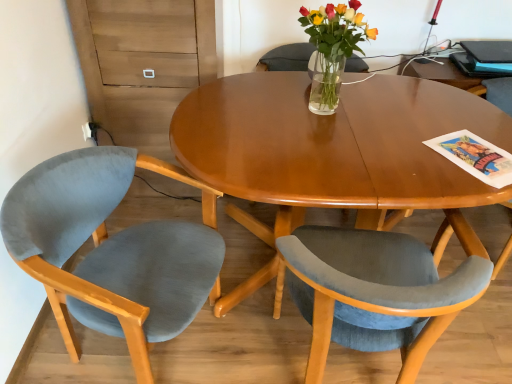
Question: Is clear glass vase at center facing towards velvet blue chair at right, placed as the 3th chair when sorted from left to right?

Choices:
 (A) no
 (B) yes

Answer: (A)

Question: Is clear glass vase at center to the right of velvet blue chair at right, which ranks as the first chair in right-to-left order, from the viewer's perspective?

Choices:
 (A) yes
 (B) no

Answer: (B)

Question: From a real-world perspective, is clear glass vase at center on top of velvet blue chair at right, which ranks as the first chair in right-to-left order?

Choices:
 (A) no
 (B) yes

Answer: (B)

Question: Would you say velvet blue chair at right, placed as the 3th chair when sorted from left to right, is part of clear glass vase at center's contents?

Choices:
 (A) yes
 (B) no

Answer: (B)

Question: Can you see clear glass vase at center touching velvet blue chair at right, placed as the 3th chair when sorted from left to right?

Choices:
 (A) no
 (B) yes

Answer: (A)

Question: In the image, is clear glass vase at center positioned in front of or behind blue glossy magazine at upper right?

Choices:
 (A) behind
 (B) front

Answer: (B)

Question: From a real-world perspective, is clear glass vase at center physically located above or below blue glossy magazine at upper right?

Choices:
 (A) below
 (B) above

Answer: (B)

Question: Is clear glass vase at center inside or outside of blue glossy magazine at upper right?

Choices:
 (A) outside
 (B) inside

Answer: (A)

Question: In terms of size, does clear glass vase at center appear bigger or smaller than blue glossy magazine at upper right?

Choices:
 (A) big
 (B) small

Answer: (A)

Question: In the image, is blue glossy magazine at upper right on the left side or the right side of clear glass vase at center?

Choices:
 (A) right
 (B) left

Answer: (A)

Question: Considering the positions of blue glossy magazine at upper right and clear glass vase at center in the image, is blue glossy magazine at upper right wider or thinner than clear glass vase at center?

Choices:
 (A) thin
 (B) wide

Answer: (B)

Question: From a real-world perspective, is blue glossy magazine at upper right physically located above or below clear glass vase at center?

Choices:
 (A) below
 (B) above

Answer: (A)

Question: In terms of height, does blue glossy magazine at upper right look taller or shorter compared to clear glass vase at center?

Choices:
 (A) short
 (B) tall

Answer: (A)

Question: Looking at their shapes, would you say velvet blue chair at center, which appears as the second chair when viewed from the left, is wider or thinner than blue glossy magazine at upper right?

Choices:
 (A) thin
 (B) wide

Answer: (B)

Question: From a real-world perspective, is velvet blue chair at center, which appears as the second chair when viewed from the left, physically located above or below blue glossy magazine at upper right?

Choices:
 (A) above
 (B) below

Answer: (B)